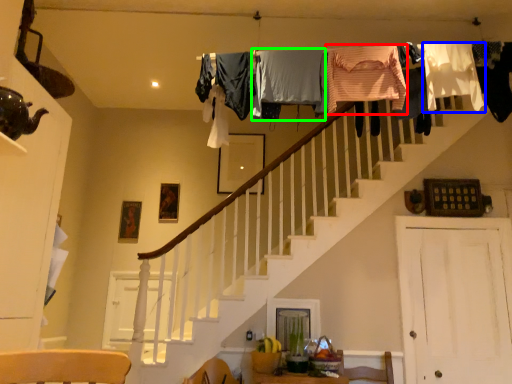
Question: Based on their relative distances, which object is farther from clothing (highlighted by a red box)? Choose from clothing (highlighted by a blue box) and clothing (highlighted by a green box).

Choices:
 (A) clothing
 (B) clothing

Answer: (A)